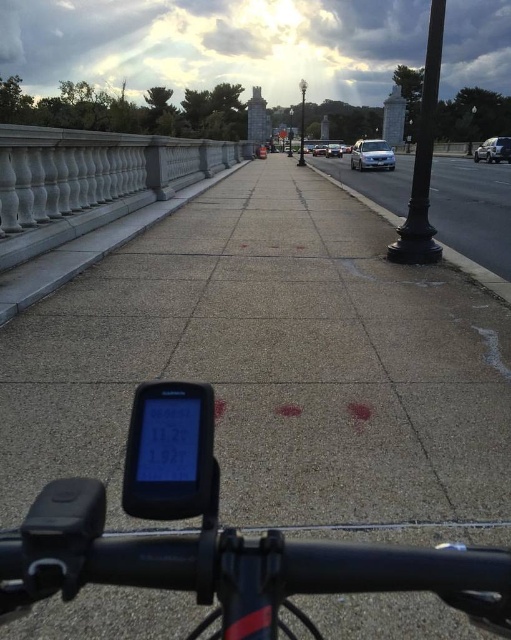
Is the position of gray concrete sidewalk at right less distant than that of black metal pole at right?

That is False.

In the scene shown: Who is more forward, (476, 230) or (421, 218)?

Point (421, 218)

Does point (394, 170) come behind point (419, 147)?

Yes, it is.

Image resolution: width=511 pixels, height=640 pixels. In order to click on gray concrete sidewalk at right in this screenshot , I will do `click(473, 211)`.

Can you confirm if gray concrete sidewalk at right is wider than silver metallic sedan at center?

Correct, the width of gray concrete sidewalk at right exceeds that of silver metallic sedan at center.

Based on the photo, does gray concrete sidewalk at right have a lesser height compared to silver metallic sedan at center?

In fact, gray concrete sidewalk at right may be taller than silver metallic sedan at center.

Describe the element at coordinates (473, 211) in the screenshot. I see `gray concrete sidewalk at right` at that location.

This screenshot has height=640, width=511. What are the coordinates of `gray concrete sidewalk at right` in the screenshot? It's located at (473, 211).

Can you confirm if silver metallic sedan at upper right is positioned to the left of black metal pole at center?

Incorrect, silver metallic sedan at upper right is not on the left side of black metal pole at center.

In order to click on silver metallic sedan at upper right in this screenshot , I will do `click(494, 148)`.

Based on the photo, who is more distant from viewer, (x=482, y=156) or (x=303, y=92)?

Positioned behind is point (x=303, y=92).

Where is `silver metallic sedan at upper right`? Image resolution: width=511 pixels, height=640 pixels. silver metallic sedan at upper right is located at coordinates (494, 148).